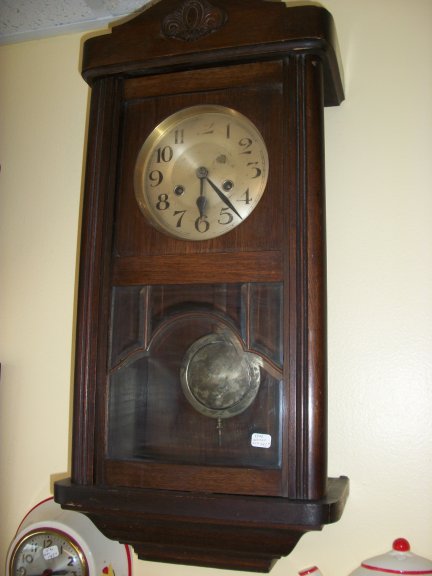
This screenshot has height=576, width=432. Identify the location of clocks. (68, 557), (201, 200).